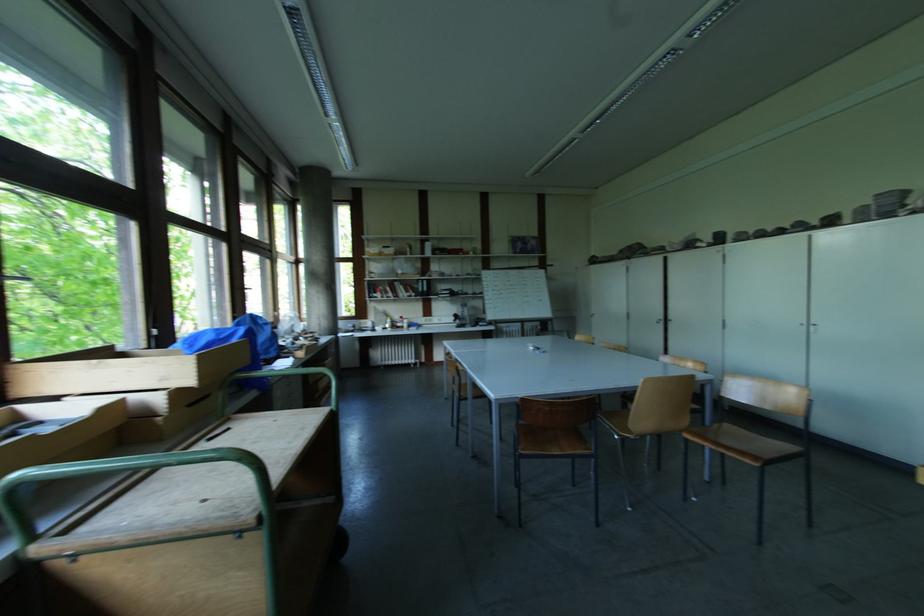
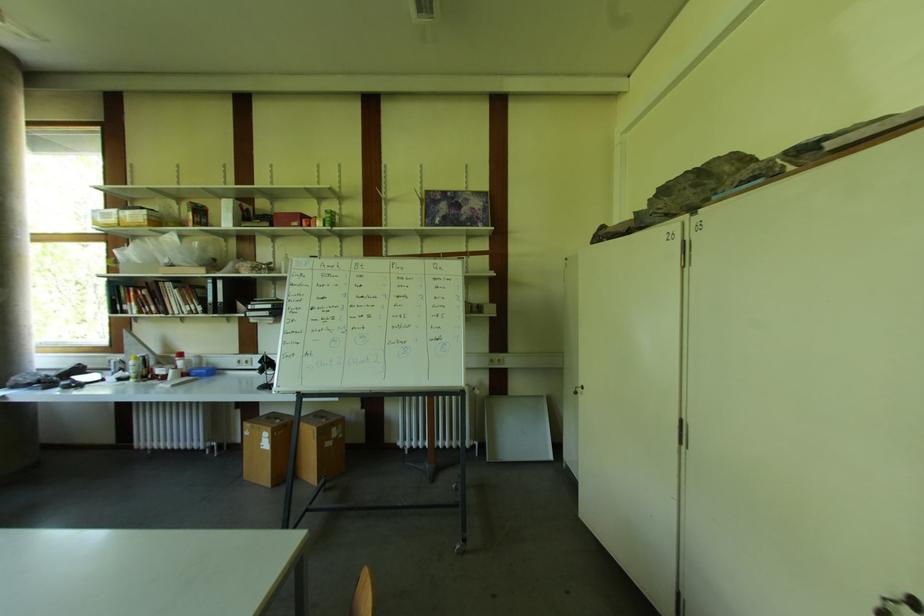
Where in the second image is the point corresponding to the point at 405,318 from the first image?

(184, 357)